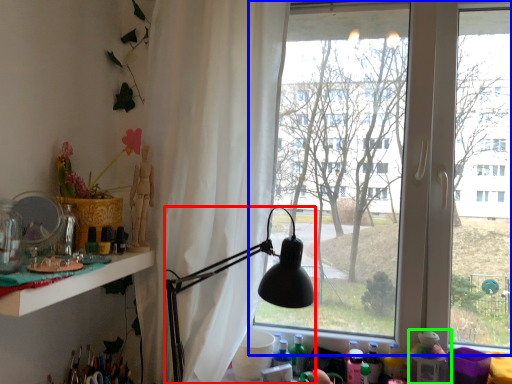
Question: Based on their relative distances, which object is farther from lamp (highlighted by a red box)? Choose from window (highlighted by a blue box) and toy (highlighted by a green box).

Choices:
 (A) window
 (B) toy

Answer: (B)